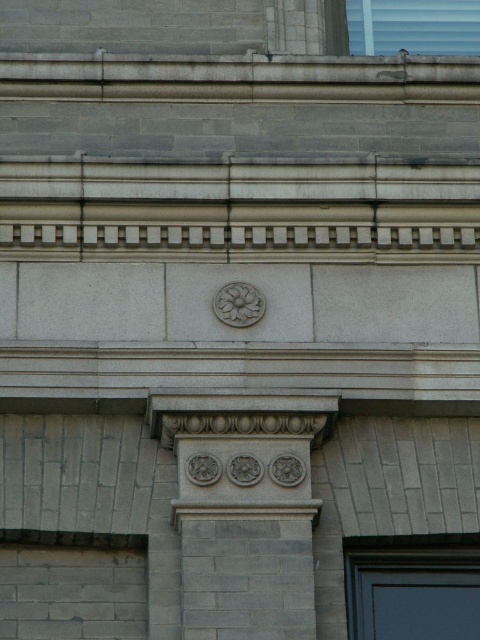
You are an architect examining the building facade. You notice the gray stone column at center and the carved stone flower at center. Which object is smaller in size?

The gray stone column at center is smaller in size compared to the carved stone flower at center.

In the scene shown: You are an architect analyzing the building facade. The gray stone column at center is positioned at coordinates. What are its exact coordinates?

The gray stone column at center is located at the coordinates point [243,509].

In the scene shown: You are an architect examining the building facade. You see the gray stone column at center and the carved stone flower at center. Which object is closer to you?

The gray stone column at center is closer to you because it is in front of the carved stone flower at center.